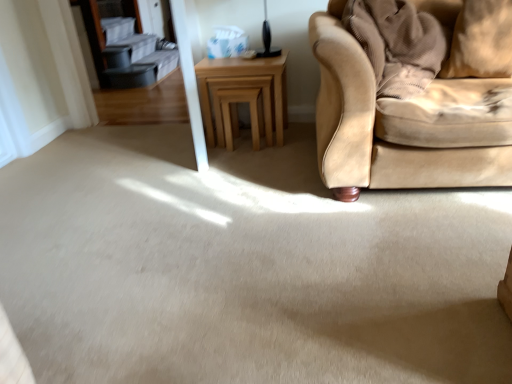
Find the location of a particular element. beige fabric pillow at upper right is located at coordinates (481, 41).

You are a GUI agent. You are given a task and a screenshot of the screen. Output one action in this format:
    pyautogui.click(x=<x>, y=<y>)
    Task: Click on the light brown wooden table at center
    The height and width of the screenshot is (384, 512).
    Given the screenshot: What is the action you would take?
    pyautogui.click(x=244, y=76)

Locate an element on the screen. This screenshot has height=384, width=512. beige fabric pillow at upper right is located at coordinates (481, 41).

Who is bigger, light brown wooden table at center or beige fabric pillow at upper right?

light brown wooden table at center.

From a real-world perspective, is light brown wooden table at center positioned above or below beige fabric pillow at upper right?

light brown wooden table at center is situated lower than beige fabric pillow at upper right in the real world.

From the image's perspective, between light brown wooden table at center and beige fabric pillow at upper right, who is located below?

light brown wooden table at center, from the image's perspective.

Considering the sizes of light brown wooden table at center and beige fabric pillow at upper right in the image, is light brown wooden table at center wider or thinner than beige fabric pillow at upper right?

light brown wooden table at center is wider than beige fabric pillow at upper right.

Can you confirm if light brown wooden table at center is shorter than light brown wooden stool at center?

No, light brown wooden table at center is not shorter than light brown wooden stool at center.

Considering the relative positions of light brown wooden table at center and light brown wooden stool at center in the image provided, is light brown wooden table at center to the left of light brown wooden stool at center from the viewer's perspective?

No.

Considering their positions, is light brown wooden table at center located in front of or behind light brown wooden stool at center?

light brown wooden table at center is positioned closer to the viewer than light brown wooden stool at center.

Would you say light brown wooden table at center is outside light brown wooden stool at center?

Yes, light brown wooden table at center is not within light brown wooden stool at center.

From the image's perspective, is light brown wooden stool at center above or below light brown wooden table at center?

light brown wooden stool at center is situated lower than light brown wooden table at center in the image.

Considering the sizes of objects light brown wooden stool at center and light brown wooden table at center in the image provided, who is smaller, light brown wooden stool at center or light brown wooden table at center?

With smaller size is light brown wooden stool at center.

Looking at their sizes, would you say light brown wooden stool at center is wider or thinner than light brown wooden table at center?

Considering their sizes, light brown wooden stool at center looks slimmer than light brown wooden table at center.

Is light brown wooden stool at center placed right next to light brown wooden table at center?

Yes, the surface of light brown wooden stool at center is in contact with light brown wooden table at center.

From a real-world perspective, between beige fabric pillow at upper right and light brown wooden stool at center, who is vertically higher?

From a 3D spatial view, beige fabric pillow at upper right is above.

Is the surface of beige fabric pillow at upper right in direct contact with light brown wooden stool at center?

No, beige fabric pillow at upper right is not in contact with light brown wooden stool at center.

Locate an element on the screen. The width and height of the screenshot is (512, 384). pillow located above the light brown wooden stool at center (from the image's perspective) is located at coordinates (481, 41).

Can you confirm if beige fabric pillow at upper right is wider than light brown wooden stool at center?

No, beige fabric pillow at upper right is not wider than light brown wooden stool at center.

From a real-world perspective, is light brown wooden stool at center physically located above or below beige fabric pillow at upper right?

In terms of real-world spatial position, light brown wooden stool at center is below beige fabric pillow at upper right.

Considering the points (221, 86) and (492, 19), which point is behind, point (221, 86) or point (492, 19)?

The point (221, 86) is more distant.

Considering the sizes of objects light brown wooden stool at center and beige fabric pillow at upper right in the image provided, who is shorter, light brown wooden stool at center or beige fabric pillow at upper right?

beige fabric pillow at upper right.

Looking at this image, could you tell me if beige fabric pillow at upper right is facing light brown wooden table at center?

No, beige fabric pillow at upper right is not turned towards light brown wooden table at center.

Are beige fabric pillow at upper right and light brown wooden table at center far apart?

That's right, there is a large distance between beige fabric pillow at upper right and light brown wooden table at center.

Is the position of beige fabric pillow at upper right less distant than that of light brown wooden table at center?

Yes, it is.

Consider the image. Can you tell me how much beige fabric pillow at upper right and light brown wooden table at center differ in facing direction?

22.2 degrees separate the facing orientations of beige fabric pillow at upper right and light brown wooden table at center.

What are the coordinates of `table to the left of beige fabric pillow at upper right` in the screenshot? It's located at (244, 76).

The width and height of the screenshot is (512, 384). In order to click on table above the light brown wooden stool at center (from a real-world perspective) in this screenshot , I will do `click(244, 76)`.

From the image, which object appears to be farther from beige fabric pillow at upper right, light brown wooden stool at center or light brown wooden table at center?

Based on the image, light brown wooden stool at center appears to be further to beige fabric pillow at upper right.

From the image, which object appears to be nearer to light brown wooden table at center, light brown wooden stool at center or beige fabric pillow at upper right?

light brown wooden stool at center lies closer to light brown wooden table at center than the other object.

Which object lies nearer to the anchor point light brown wooden stool at center, light brown wooden table at center or beige fabric pillow at upper right?

light brown wooden table at center is positioned closer to the anchor light brown wooden stool at center.

Looking at the image, which one is located further to beige fabric pillow at upper right, light brown wooden table at center or light brown wooden stool at center?

light brown wooden stool at center.

Which object lies further to the anchor point light brown wooden table at center, beige fabric pillow at upper right or light brown wooden stool at center?

beige fabric pillow at upper right.

Based on their spatial positions, is beige fabric pillow at upper right or light brown wooden table at center closer to light brown wooden stool at center?

Among the two, light brown wooden table at center is located nearer to light brown wooden stool at center.

At what (x,y) coordinates should I click in order to perform the action: click on table between light brown wooden stool at center and beige fabric pillow at upper right from left to right. Please return your answer as a coordinate pair (x, y). Looking at the image, I should click on (244, 76).